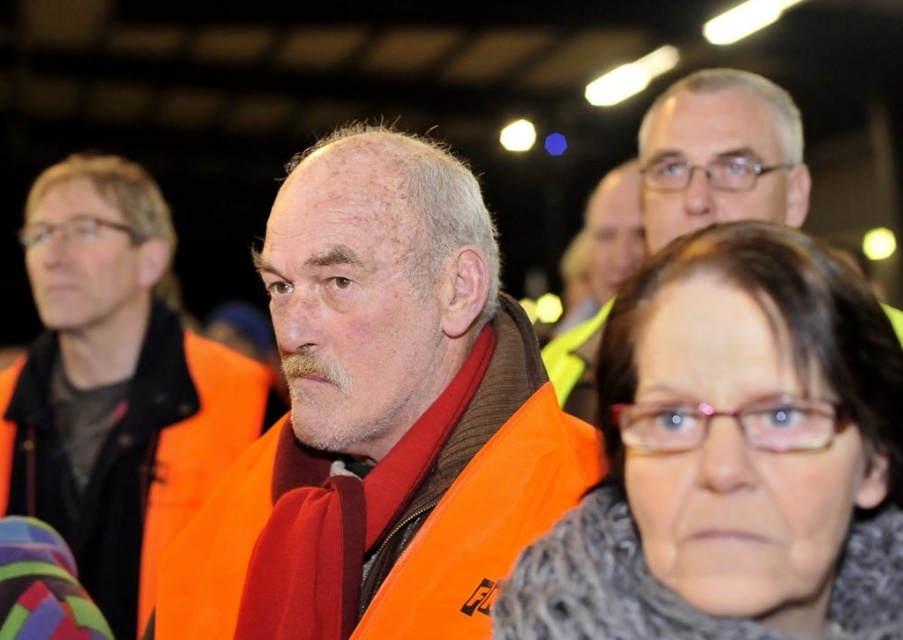
You are a security guard at the event and need to quickly identify the closest orange vest to ensure safety protocols are followed. Which orange vest is closer to you, the orange fabric vest at center or the matte orange vest at upper right?

The orange fabric vest at center is closer to the viewer than the matte orange vest at upper right, so the closest one is the orange fabric vest at center.